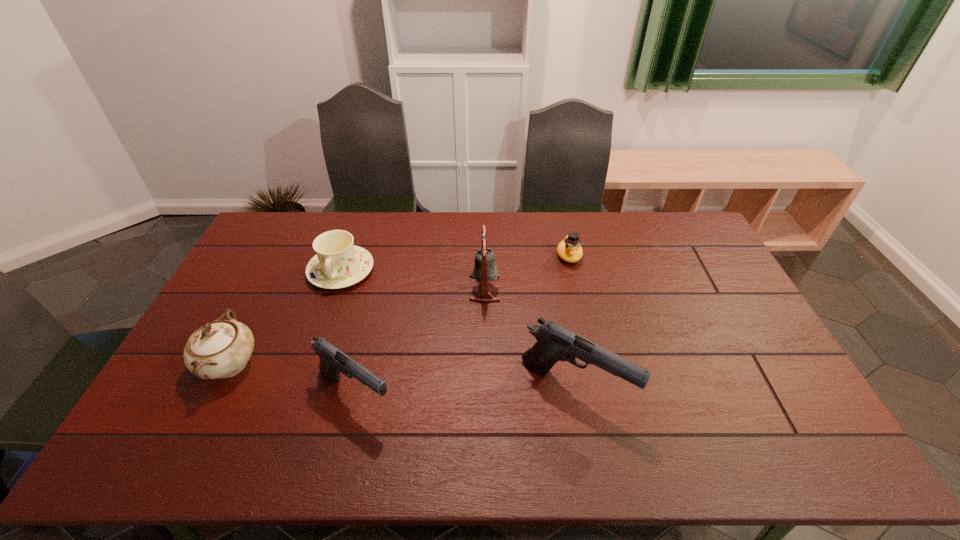
In order to click on vacant space at the near edge of the desktop in this screenshot , I will do `click(708, 396)`.

The image size is (960, 540). I want to click on vacant region at the left edge, so click(254, 254).

The height and width of the screenshot is (540, 960). In order to click on vacant space at the right edge of the desktop in this screenshot , I will do `click(727, 375)`.

This screenshot has height=540, width=960. In the image, there is a desktop. In order to click on vacant space at the far right corner in this screenshot , I will do `click(682, 219)`.

Image resolution: width=960 pixels, height=540 pixels. I want to click on free space between the shorter gun and the taller chinaware, so click(293, 380).

At what (x,y) coordinates should I click in order to perform the action: click on vacant area that lies between the right chinaware and the left gun. Please return your answer as a coordinate pair (x, y). Looking at the image, I should click on (348, 333).

Image resolution: width=960 pixels, height=540 pixels. Find the location of `blank region between the nearer chinaware and the third object from right to left`. blank region between the nearer chinaware and the third object from right to left is located at coordinates (357, 326).

Locate an element on the screen. This screenshot has width=960, height=540. unoccupied position between the farther chinaware and the duck is located at coordinates (455, 263).

You are a GUI agent. You are given a task and a screenshot of the screen. Output one action in this format:
    pyautogui.click(x=<x>, y=<y>)
    Task: Click on the vacant area that lies between the leftmost object and the duck
    Image resolution: width=960 pixels, height=540 pixels.
    Given the screenshot: What is the action you would take?
    pyautogui.click(x=399, y=310)

Identify the location of blank region between the shorter gun and the right gun. This screenshot has width=960, height=540. coord(465,392).